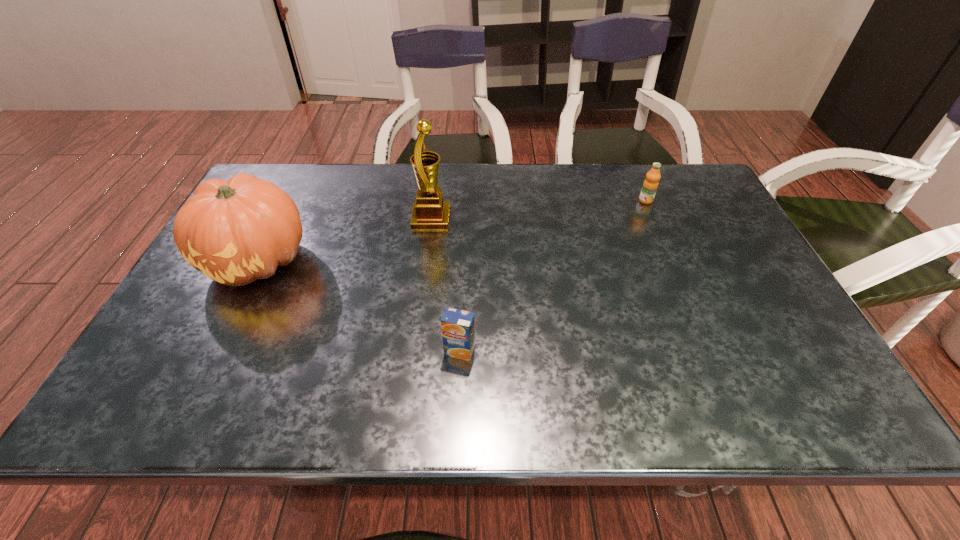
Identify the location of vacant point that satisfies the following two spatial constraints: 1. on the label of the farther orange_juice; 2. on the front-facing side of the tallest object. Image resolution: width=960 pixels, height=540 pixels. (654, 219).

Locate an element on the screen. The height and width of the screenshot is (540, 960). vacant point that satisfies the following two spatial constraints: 1. on the front-facing side of the second object from left to right; 2. on the carved face of the third shortest object is located at coordinates (426, 260).

Identify the location of free space that satisfies the following two spatial constraints: 1. on the carved face of the pumpkin; 2. on the right side of the nearer orange_juice. This screenshot has width=960, height=540. (212, 351).